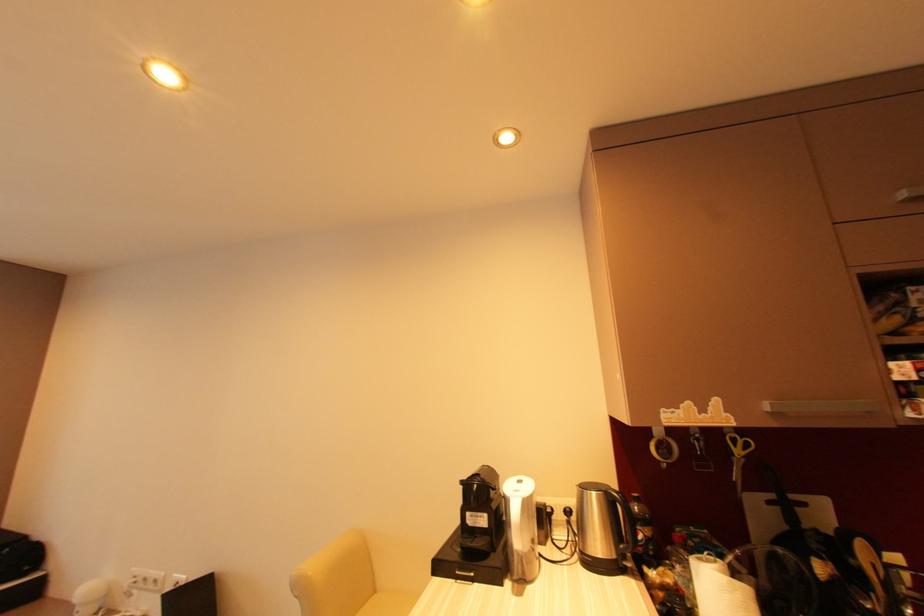
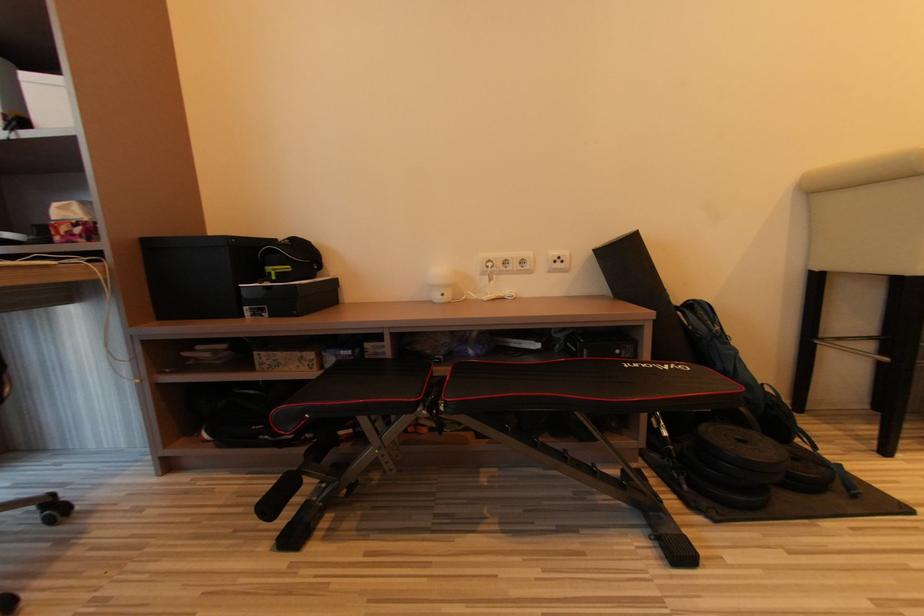
Question: What movement of the cameraman would produce the second image?

Choices:
 (A) Left
 (B) Right
 (C) Forward
 (D) Backward

Answer: (A)